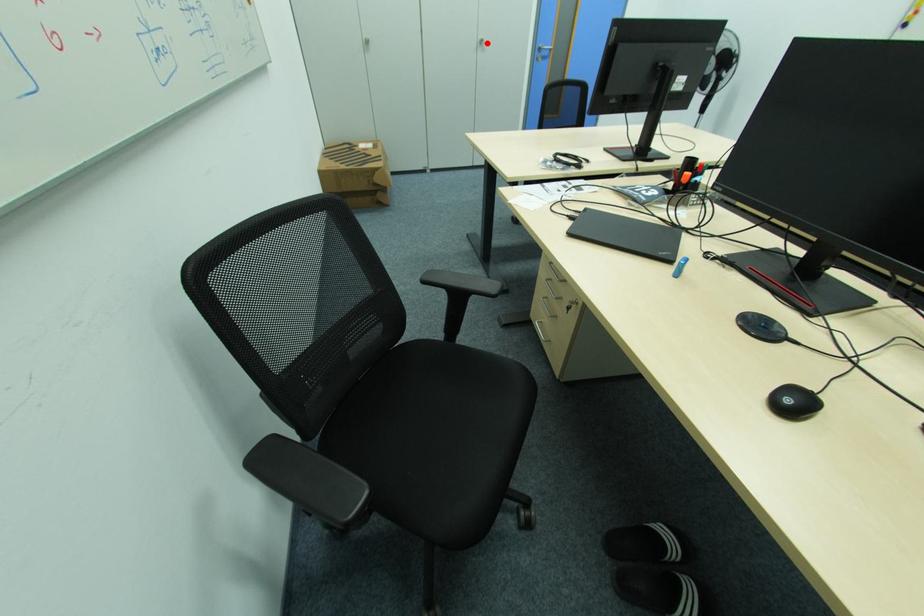
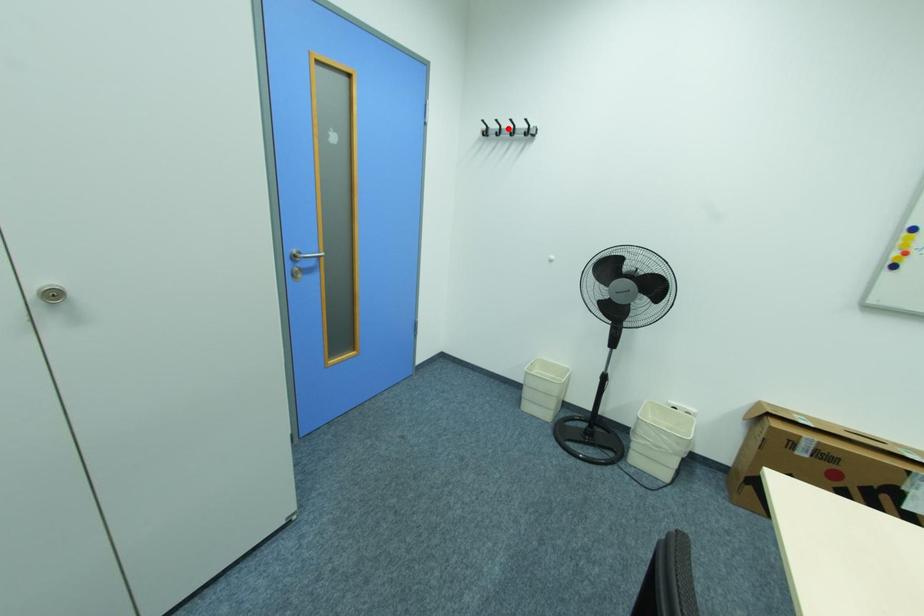
I am providing you with two images of the same scene from different viewpoints. A red point is marked on the first image and another point is marked on the second image. Are the points marked in image1 and image2 representing the same 3D position?

No